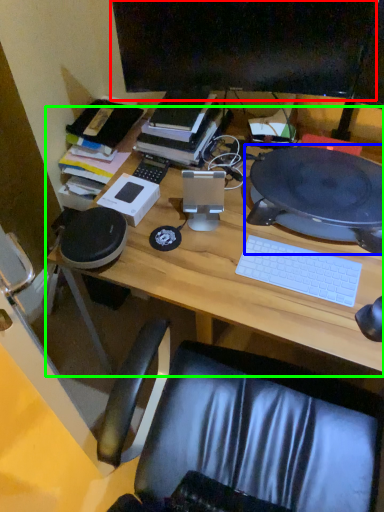
Question: Based on their relative distances, which object is farther from computer monitor (highlighted by a red box)? Choose from computer (highlighted by a blue box) and desk (highlighted by a green box).

Choices:
 (A) computer
 (B) desk

Answer: (B)